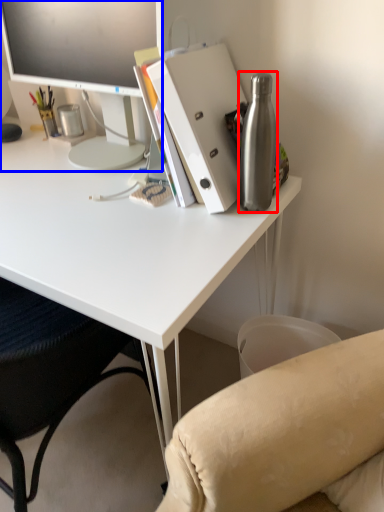
Question: Among these objects, which one is nearest to the camera, bottle (highlighted by a red box) or television (highlighted by a blue box)?

Choices:
 (A) bottle
 (B) television

Answer: (A)